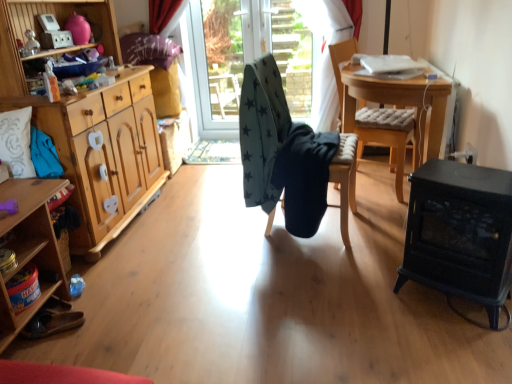
The image size is (512, 384). I want to click on free space between brown leather shoes at lower left and dark blue fabric at center, the second chair in the left-to-right sequence, so click(x=195, y=269).